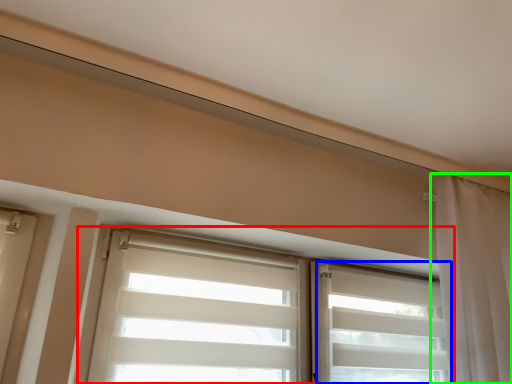
Question: Considering the real-world distances, which object is closest to window (highlighted by a red box)? shutter (highlighted by a blue box) or curtain (highlighted by a green box).

Choices:
 (A) shutter
 (B) curtain

Answer: (A)